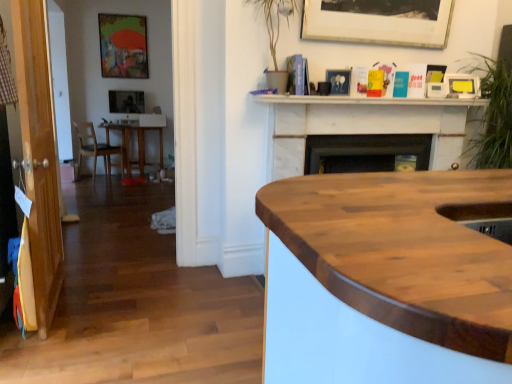
Identify the location of vacant area that lies to the right of transparent wood door at left. (123, 303).